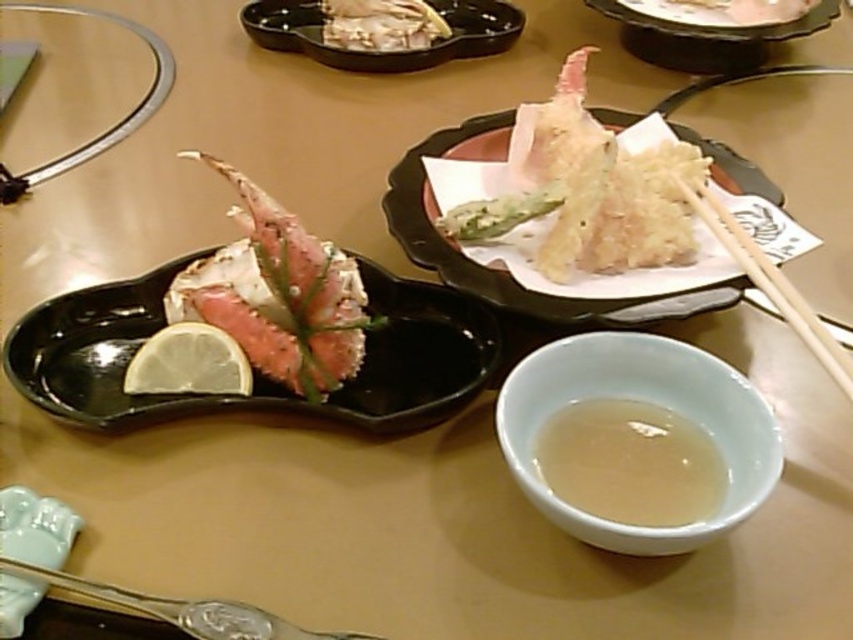
You are a customer at this Japanese restaurant and want to pour the translucent liquid at center into a cup that is 16 inches away from you. Can you reach it without moving your chair?

The translucent liquid at center is 15.98 inches from the viewer, which is just under 16 inches, so you can likely reach it without moving your chair.

You are a diner at the table and want to pick up the black glossy plate at center left using the white wood chopsticks at right. Can you reach the plate with the chopsticks from their current position?

The black glossy plate at center left is positioned under the white wood chopsticks at right, so yes, the diner can reach the plate with the chopsticks from their current position since the chopsticks are already above it.

From the picture: You are a server who needs to place a 25 cm long utensil between the black glossy plate at center left and the white wood chopsticks at right. Is there enough space?

The distance between the black glossy plate at center left and the white wood chopsticks at right is 30.38 centimeters, so yes, there is enough space to place a 25 cm long utensil between them since the distance is greater than the utensil length.